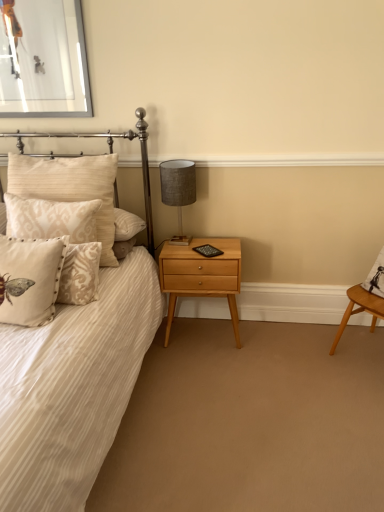
Where is `free spot below textured gray lampshade at upper right (from a real-world perspective)`? The height and width of the screenshot is (512, 384). free spot below textured gray lampshade at upper right (from a real-world perspective) is located at coordinates (178, 243).